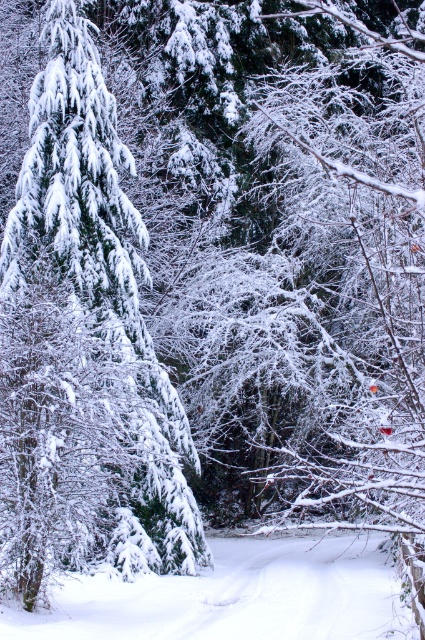
Who is taller, green matte tree at left or white fluffy snow at center?

Standing taller between the two is green matte tree at left.

Between green matte tree at left and white fluffy snow at center, which one is positioned higher?

green matte tree at left

Measure the distance between green matte tree at left and camera.

A distance of 13.96 meters exists between green matte tree at left and camera.

Find the location of a particular element. The image size is (425, 640). green matte tree at left is located at coordinates (104, 291).